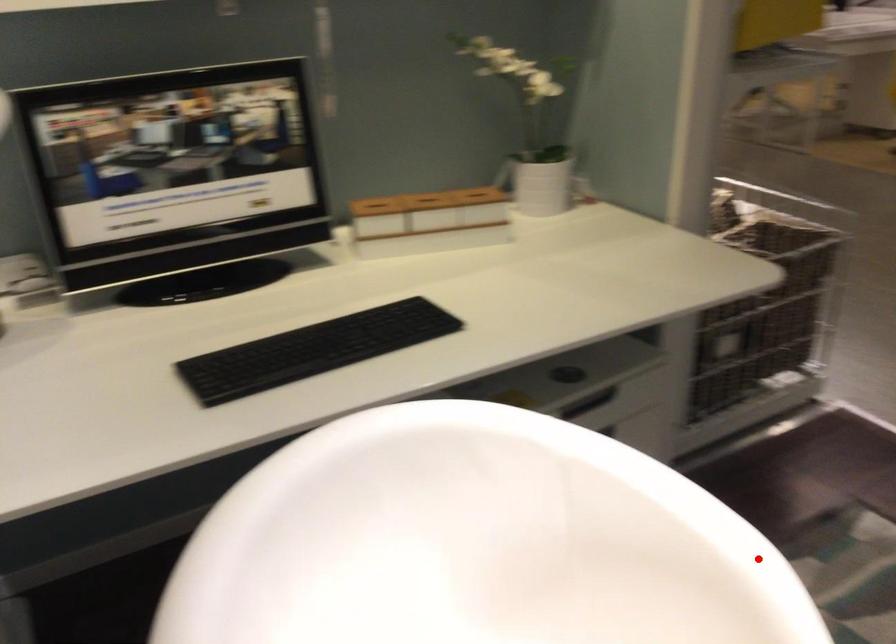
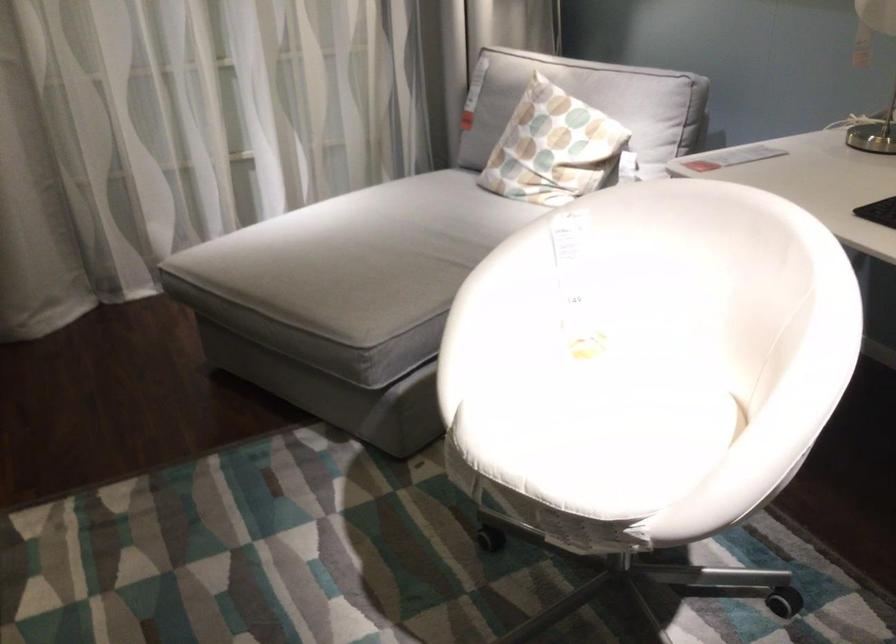
Locate, in the second image, the point that corresponds to the highlighted location in the first image.

(780, 399)